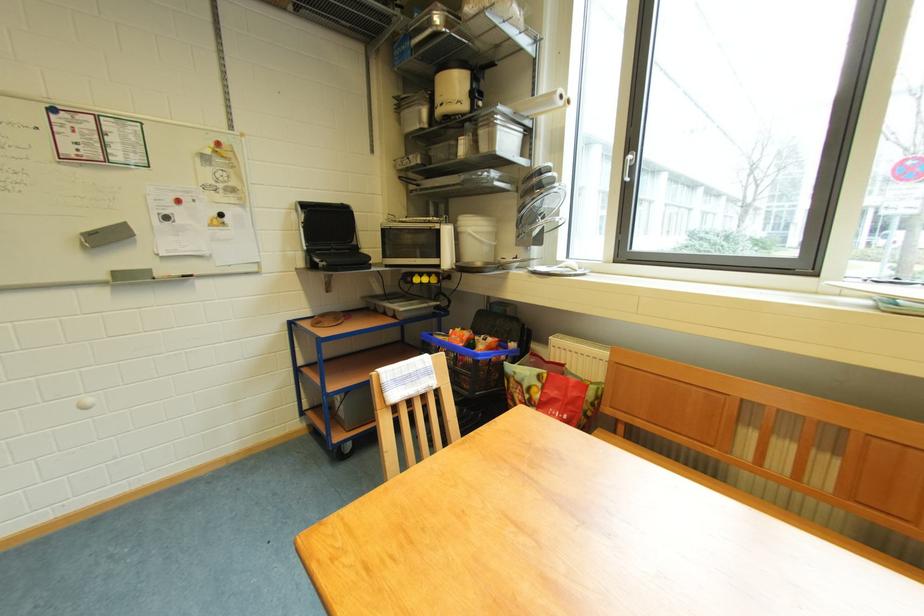
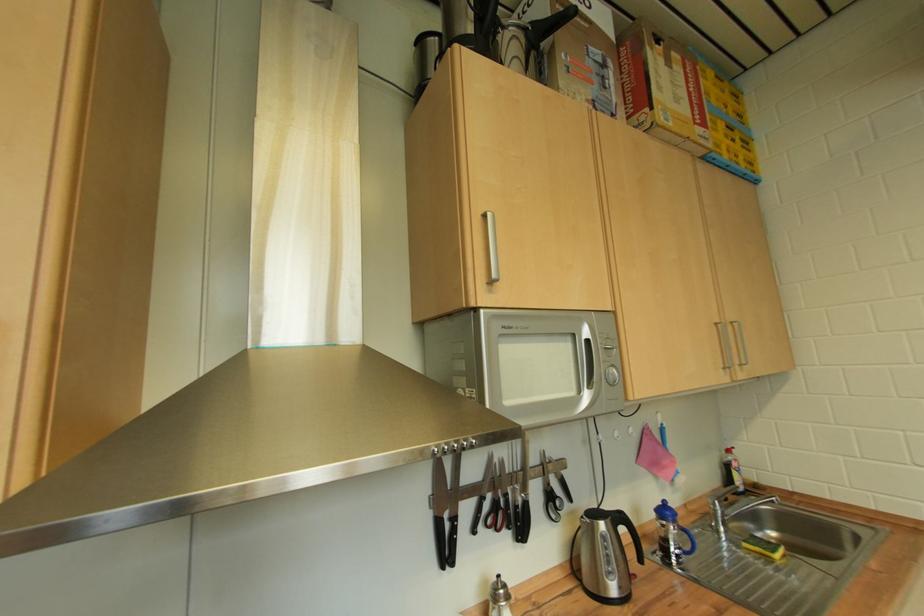
Question: The camera is either moving clockwise (left) or counter-clockwise (right) around the object. The first image is from the beginning of the video and the second image is from the end. Is the camera moving left or right when shooting the video?

Choices:
 (A) Left
 (B) Right

Answer: (B)